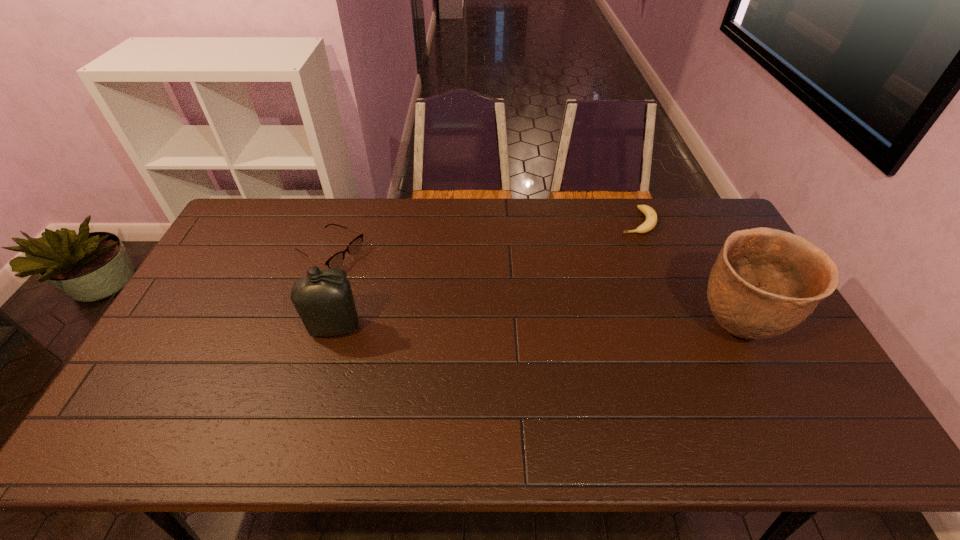
In order to click on the second tallest object in this screenshot , I will do `click(324, 301)`.

The height and width of the screenshot is (540, 960). In order to click on pottery in this screenshot , I will do `click(765, 281)`.

You are a GUI agent. You are given a task and a screenshot of the screen. Output one action in this format:
    pyautogui.click(x=<x>, y=<y>)
    Task: Click on the spectacles
    
    Given the screenshot: What is the action you would take?
    pyautogui.click(x=335, y=261)

Identify the location of banana. (651, 217).

Locate an element on the screen. The width and height of the screenshot is (960, 540). free location located 0.050m on the right of the second tallest object is located at coordinates (378, 328).

Locate an element on the screen. Image resolution: width=960 pixels, height=540 pixels. vacant space located on the back of the pottery is located at coordinates (680, 219).

Locate an element on the screen. Image resolution: width=960 pixels, height=540 pixels. free spot located on the face of the spectacles is located at coordinates (389, 282).

Locate an element on the screen. vacant area situated 0.220m on the face of the spectacles is located at coordinates (408, 292).

The image size is (960, 540). I want to click on blank space located on the face of the spectacles, so point(414,295).

This screenshot has width=960, height=540. I want to click on blank space located 0.270m at the stem of the shortest object, so click(x=609, y=284).